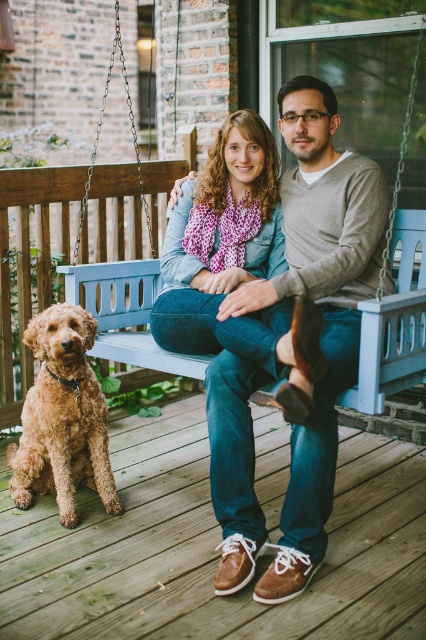
You are a delivery person trying to place a small package on the porch. The package is 20 cm wide. You see the blue wooden swing at center and the denim scarf at center. Can you tell me if the space between them is wide enough to place the package?

The blue wooden swing at center is wider than the denim scarf at center. Therefore, the space between them may be sufficient to place the 20 cm wide package, but it depends on the exact dimensions of the swing and scarf.

You are a photographer taking a picture of the scene. You notice the denim scarf at center and the matte brown shoes at center. Which object should you adjust to ensure both are fully visible in the photo?

To ensure both the denim scarf at center and the matte brown shoes at center are fully visible, you should adjust the denim scarf at center since it is positioned behind the matte brown shoes at center, causing potential obstruction.